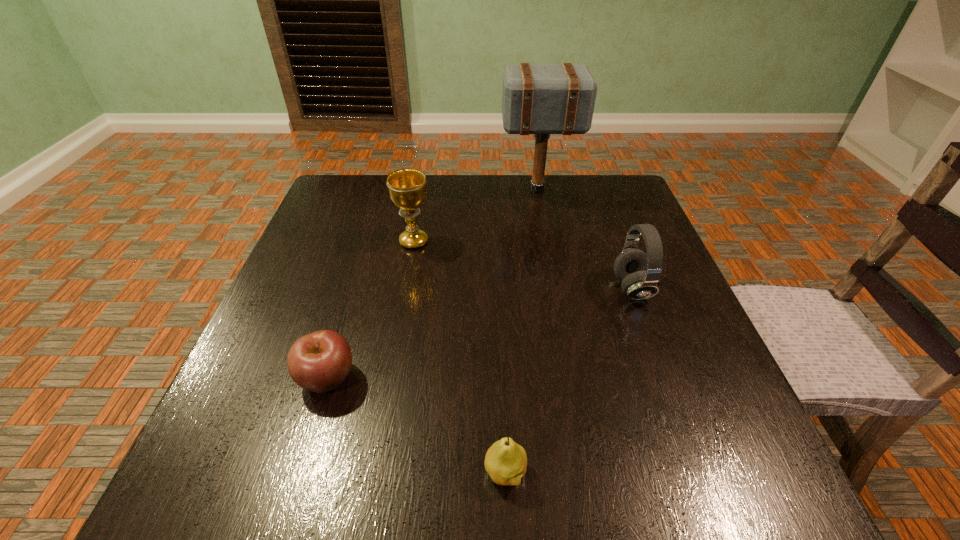
This screenshot has height=540, width=960. In order to click on vacant space that's between the rightmost object and the farthest object in this screenshot , I will do `click(585, 239)`.

Locate an element on the screen. The height and width of the screenshot is (540, 960). the third closest object to the pear is located at coordinates (407, 187).

Point out which object is positioned as the third nearest to the nearest object. Please provide its 2D coordinates. Your answer should be formatted as a tuple, i.e. [(x, y)], where the tuple contains the x and y coordinates of a point satisfying the conditions above.

[(407, 187)]

The height and width of the screenshot is (540, 960). In order to click on vacant space that satisfies the following two spatial constraints: 1. on the ear cups of the rightmost object; 2. on the front side of the pear in this screenshot , I will do `click(700, 472)`.

The width and height of the screenshot is (960, 540). In order to click on vacant space that satisfies the following two spatial constraints: 1. on the striking surface of the farthest object; 2. on the front side of the second object from left to right in this screenshot , I will do `click(547, 241)`.

Locate an element on the screen. The height and width of the screenshot is (540, 960). free space that satisfies the following two spatial constraints: 1. on the striking surface of the mallet; 2. on the front side of the second farthest object is located at coordinates (547, 241).

Identify the location of vacant space that satisfies the following two spatial constraints: 1. on the back side of the nearest object; 2. on the side of the leftmost object with the unique marking. (501, 377).